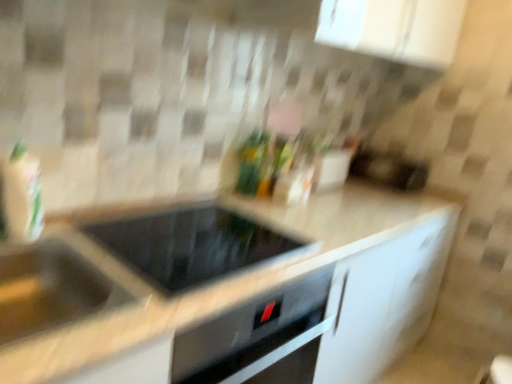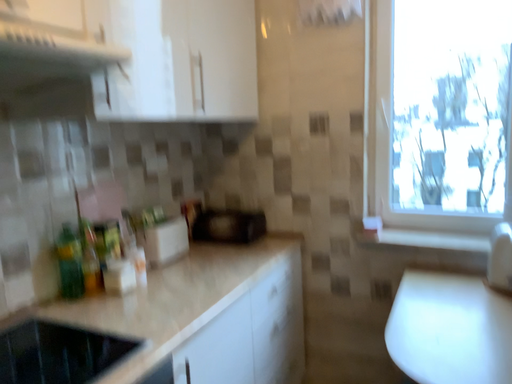
Question: Which way did the camera rotate in the video?

Choices:
 (A) rotated left
 (B) rotated right

Answer: (B)